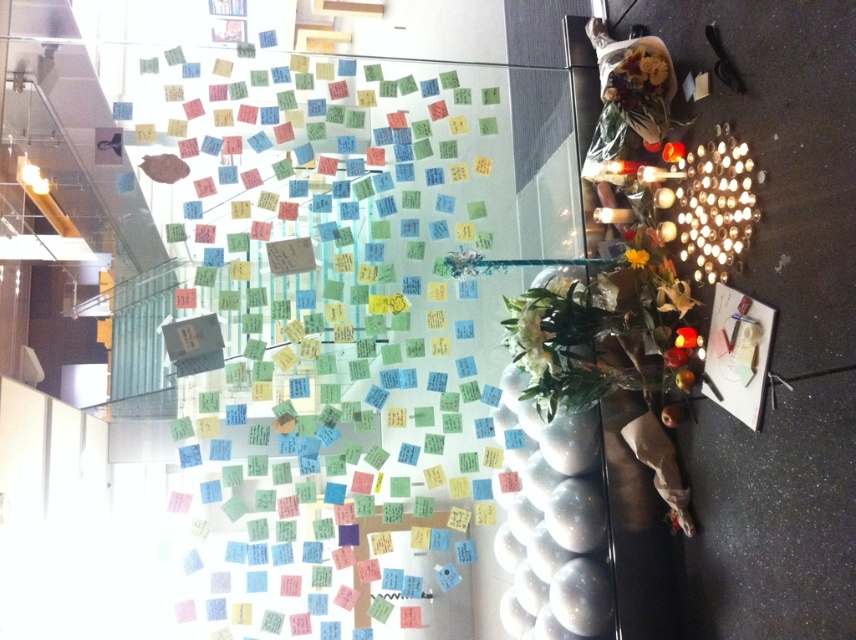
Can you confirm if colorful paper notes at center is smaller than yellow matte flower at upper center?

No.

Does point (300, 509) come in front of point (628, 260)?

That is False.

Who is more distant from viewer, (x=207, y=116) or (x=645, y=259)?

Point (x=207, y=116)

At what (x,y) coordinates should I click in order to perform the action: click on colorful paper notes at center. Please return your answer as a coordinate pair (x, y). The image size is (856, 640). Looking at the image, I should click on (342, 342).